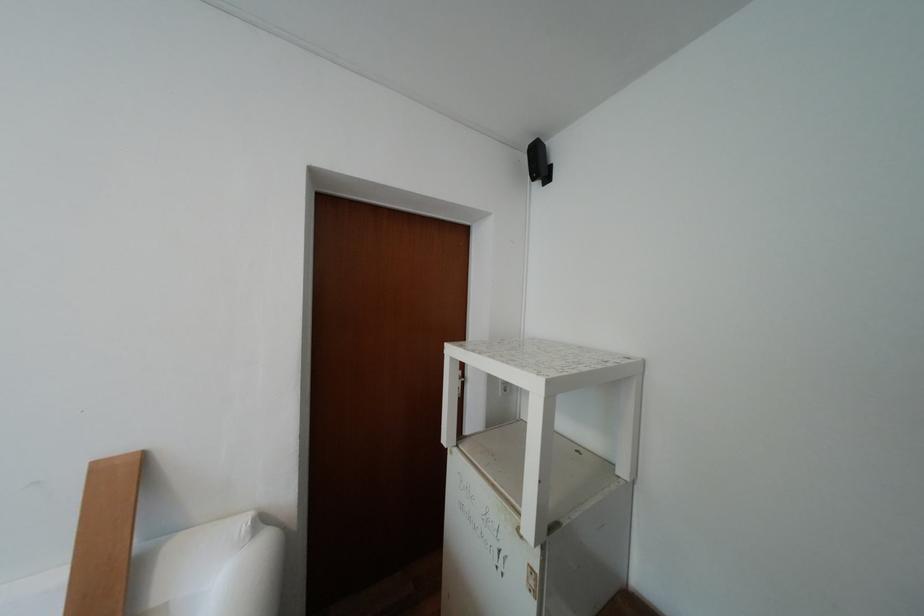
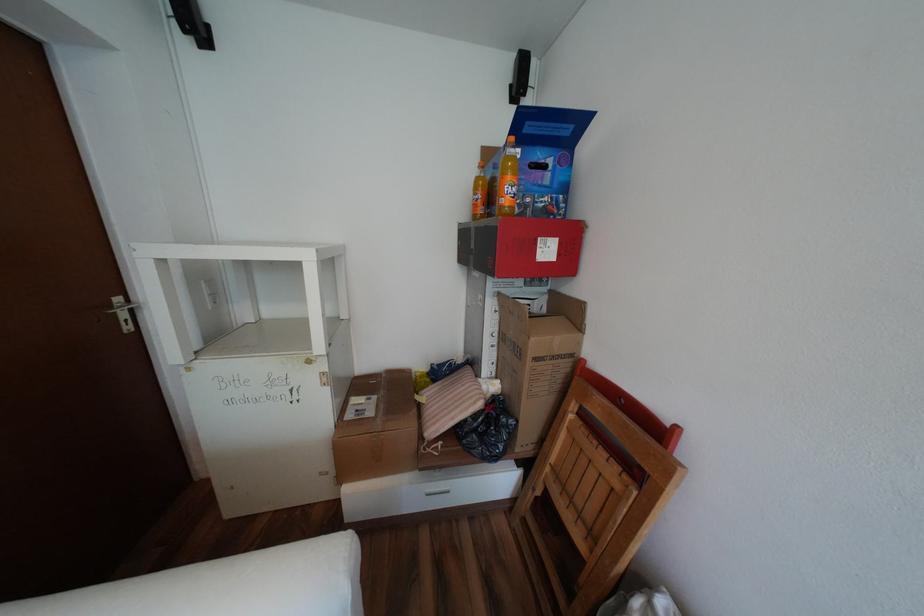
The first image is from the beginning of the video and the second image is from the end. How did the camera likely rotate when shooting the video?

The camera's rotation is toward right-down.